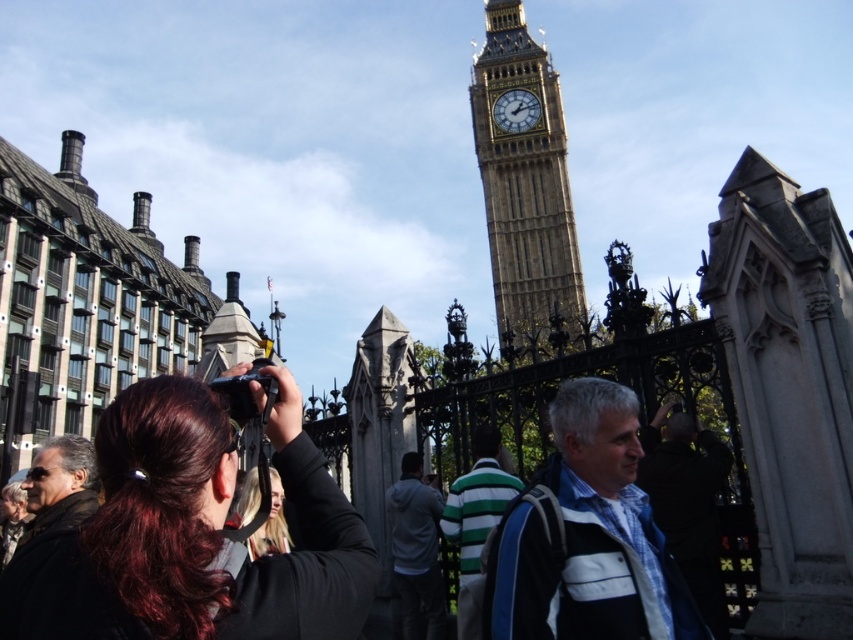
Question: Which point is closer to the camera?

Choices:
 (A) (36, 497)
 (B) (699, 492)

Answer: (B)

Question: Which point is farther to the camera?

Choices:
 (A) (99, 632)
 (B) (711, 474)
 (C) (433, 493)

Answer: (C)

Question: Is blue-and-white striped shirt at center to the right of stone clock tower at center from the viewer's perspective?

Choices:
 (A) yes
 (B) no

Answer: (B)

Question: Does shiny black camera at center have a larger size compared to gray hoodie at center?

Choices:
 (A) no
 (B) yes

Answer: (B)

Question: Can you confirm if black leather jacket at lower left is positioned above gold textured clock at center?

Choices:
 (A) no
 (B) yes

Answer: (A)

Question: Among these objects, which one is farthest from the camera?

Choices:
 (A) gray hoodie at center
 (B) gold textured clock at center

Answer: (B)